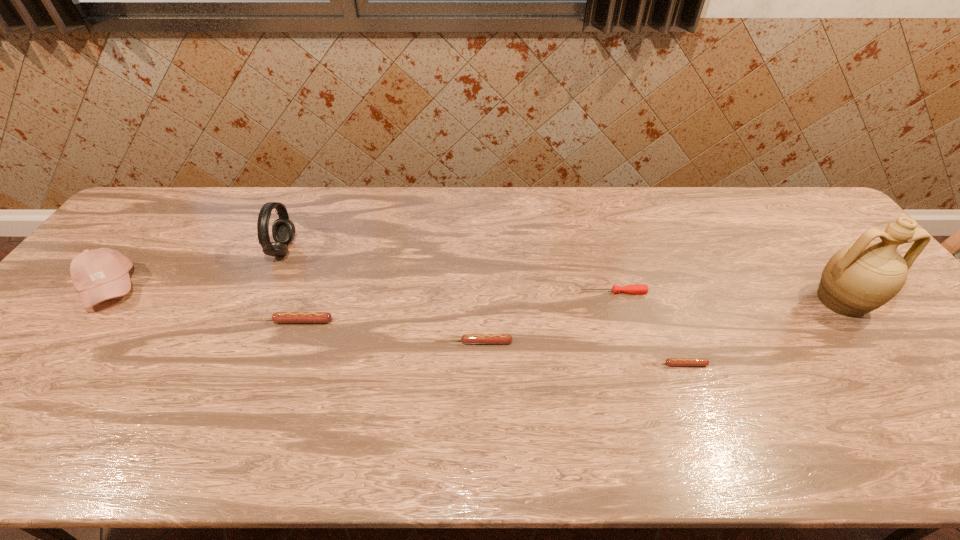
Identify the location of free point between the leftmost object and the pitcher. (475, 294).

I want to click on empty space between the rightmost sausage and the screwdriver, so click(x=644, y=328).

You are a GUI agent. You are given a task and a screenshot of the screen. Output one action in this format:
    pyautogui.click(x=<x>, y=<y>)
    Task: Click on the free space between the fourth shortest object and the third tallest object
    This screenshot has width=960, height=540.
    Given the screenshot: What is the action you would take?
    pyautogui.click(x=200, y=305)

The width and height of the screenshot is (960, 540). What are the coordinates of `vacant area that lies between the screwdriver and the nearest sausage` in the screenshot? It's located at (644, 328).

The width and height of the screenshot is (960, 540). Identify the location of unoccupied area between the rightmost object and the farthest sausage. coord(564,311).

At what (x,y) coordinates should I click in order to perform the action: click on vacant area between the second nearest object and the headset. Please return your answer as a coordinate pair (x, y). Image resolution: width=960 pixels, height=540 pixels. Looking at the image, I should click on click(x=379, y=295).

This screenshot has width=960, height=540. What are the coordinates of `vacant space that's between the screwdriver and the second tallest object` in the screenshot? It's located at (448, 271).

Identify which object is the sixth closest to the headset. Please provide its 2D coordinates. Your answer should be formatted as a tuple, i.e. [(x, y)], where the tuple contains the x and y coordinates of a point satisfying the conditions above.

[(860, 277)]

Identify which object is located as the fourth nearest to the rightmost object. Please provide its 2D coordinates. Your answer should be formatted as a tuple, i.e. [(x, y)], where the tuple contains the x and y coordinates of a point satisfying the conditions above.

[(279, 317)]

Identify which sausage is located as the nearest to the fourth tallest object. Please provide its 2D coordinates. Your answer should be formatted as a tuple, i.e. [(x, y)], where the tuple contains the x and y coordinates of a point satisfying the conditions above.

[(466, 338)]